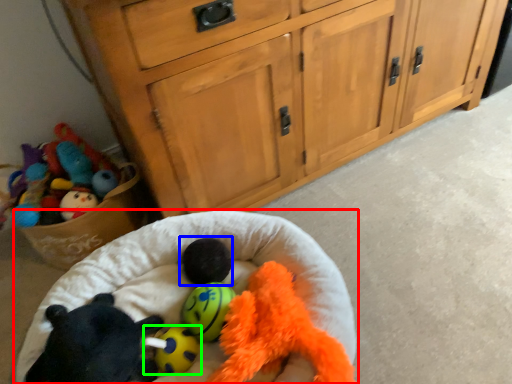
Question: Estimate the real-world distances between objects in this image. Which object is closer to infant bed (highlighted by a red box), animal (highlighted by a blue box) or toy (highlighted by a green box)?

Choices:
 (A) animal
 (B) toy

Answer: (A)